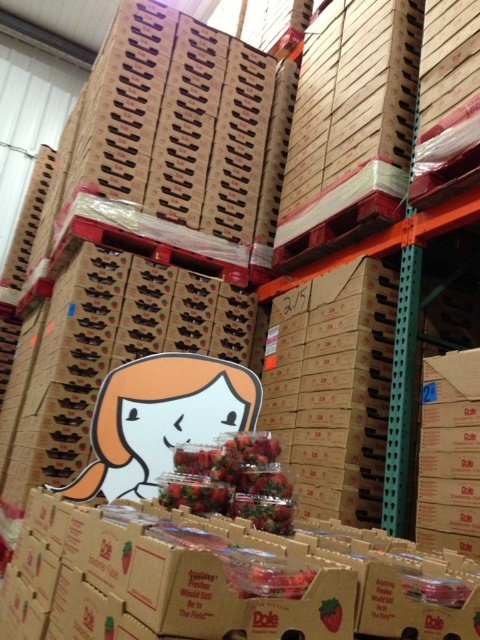
Question: Can you confirm if shiny red strawberries at center is positioned above smooth red strawberry at center?

Choices:
 (A) yes
 (B) no

Answer: (A)

Question: Is shiny red strawberries at center to the left of smooth red strawberry at center from the viewer's perspective?

Choices:
 (A) no
 (B) yes

Answer: (B)

Question: Can you confirm if shiny red strawberries at center is smaller than smooth red strawberry at center?

Choices:
 (A) no
 (B) yes

Answer: (A)

Question: Among these points, which one is nearest to the camera?

Choices:
 (A) (235, 458)
 (B) (337, 602)

Answer: (B)

Question: Among these points, which one is nearest to the camera?

Choices:
 (A) (332, 624)
 (B) (190, 468)

Answer: (A)